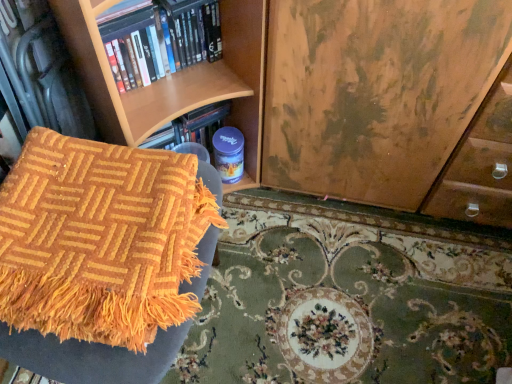
Question: From the image's perspective, does hardcover books at upper left appear lower than orange woven mat at lower left?

Choices:
 (A) yes
 (B) no

Answer: (B)

Question: Is hardcover books at upper left next to orange woven mat at lower left?

Choices:
 (A) yes
 (B) no

Answer: (B)

Question: Is hardcover books at upper left looking in the opposite direction of orange woven mat at lower left?

Choices:
 (A) yes
 (B) no

Answer: (B)

Question: Is hardcover books at upper left at the left side of orange woven mat at lower left?

Choices:
 (A) no
 (B) yes

Answer: (B)

Question: Considering the relative sizes of hardcover books at upper left and orange woven mat at lower left in the image provided, is hardcover books at upper left smaller than orange woven mat at lower left?

Choices:
 (A) no
 (B) yes

Answer: (B)

Question: Is hardcover books at upper left oriented towards orange woven mat at lower left?

Choices:
 (A) no
 (B) yes

Answer: (A)

Question: Is orange woven blanket at lower left a part of orange woven mat at lower left?

Choices:
 (A) yes
 (B) no

Answer: (B)

Question: Is orange woven mat at lower left facing away from orange woven blanket at lower left?

Choices:
 (A) yes
 (B) no

Answer: (B)

Question: Is orange woven mat at lower left outside of orange woven blanket at lower left?

Choices:
 (A) no
 (B) yes

Answer: (B)

Question: From a real-world perspective, is orange woven mat at lower left below orange woven blanket at lower left?

Choices:
 (A) no
 (B) yes

Answer: (B)

Question: Is orange woven mat at lower left positioned behind orange woven blanket at lower left?

Choices:
 (A) no
 (B) yes

Answer: (B)

Question: Is orange woven mat at lower left at the right side of orange woven blanket at lower left?

Choices:
 (A) no
 (B) yes

Answer: (B)

Question: Is orange woven blanket at lower left to the left of orange woven mat at lower left from the viewer's perspective?

Choices:
 (A) yes
 (B) no

Answer: (A)